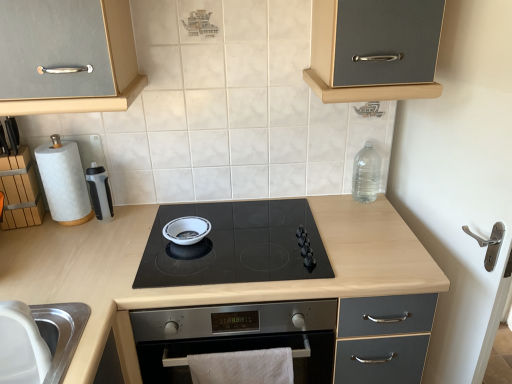
Image resolution: width=512 pixels, height=384 pixels. Find the location of `free space to the right of wooden block at left`. free space to the right of wooden block at left is located at coordinates (59, 236).